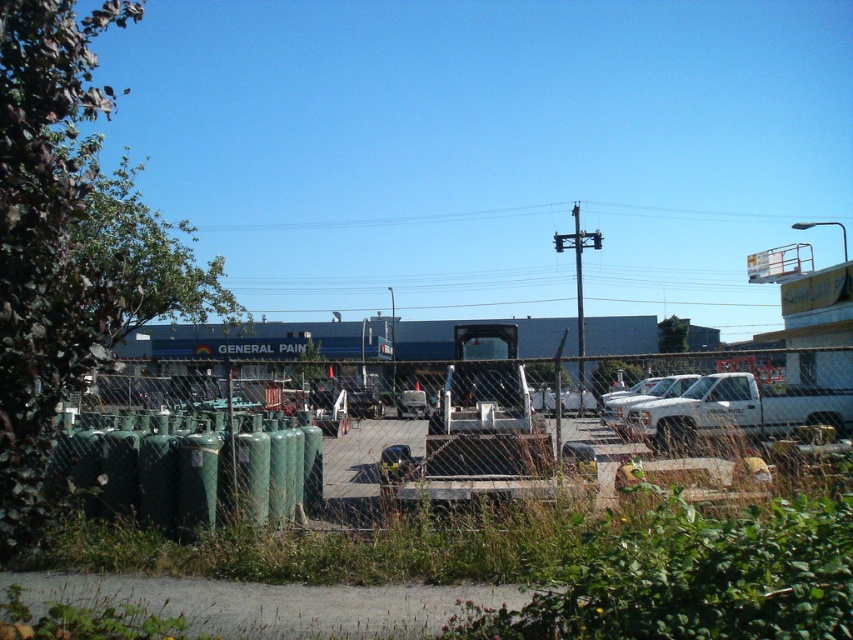
Measure the distance between point (486, 417) and camera.

Point (486, 417) is 14.69 meters from camera.

Who is lower down, green matte cylinders at lower left or white matte truck at right?

white matte truck at right is lower down.

You are a GUI agent. You are given a task and a screenshot of the screen. Output one action in this format:
    pyautogui.click(x=<x>, y=<y>)
    Task: Click on the green matte cylinders at lower left
    
    Given the screenshot: What is the action you would take?
    pyautogui.click(x=581, y=429)

In order to click on green matte cylinders at lower left in this screenshot , I will do `click(581, 429)`.

Consider the image. Does green matte cylinders at lower left have a greater height compared to white matte truck at center?

Indeed, green matte cylinders at lower left has a greater height compared to white matte truck at center.

Can you confirm if green matte cylinders at lower left is positioned below white matte truck at center?

Indeed, green matte cylinders at lower left is positioned under white matte truck at center.

I want to click on green matte cylinders at lower left, so click(x=581, y=429).

Between white matte truck at right and white matte truck at center, which one appears on the right side from the viewer's perspective?

white matte truck at right

Between white matte truck at right and white matte truck at center, which one has less height?

With less height is white matte truck at center.

Is point (728, 388) more distant than point (624, 413)?

No, (728, 388) is in front of (624, 413).

Where is `white matte truck at right`? white matte truck at right is located at coordinates (735, 412).